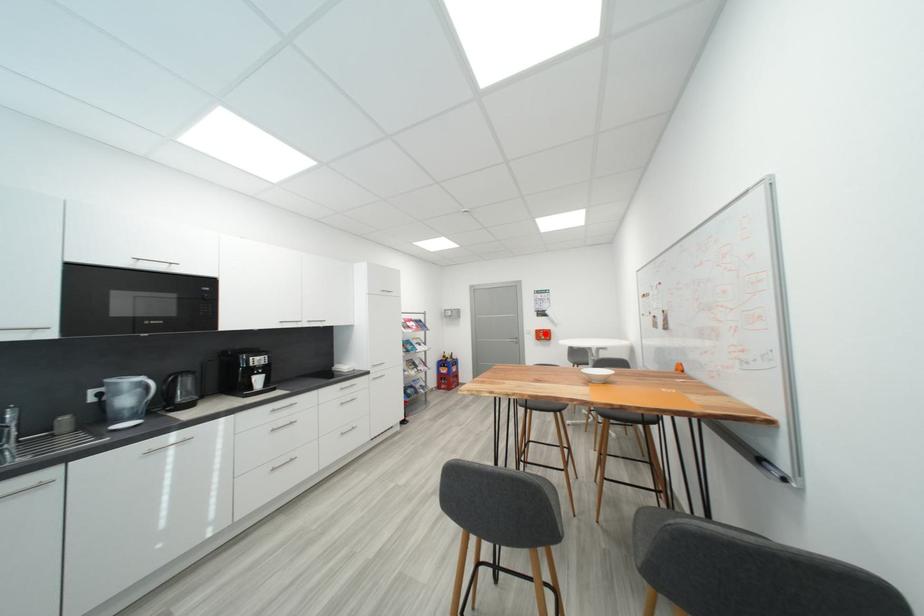
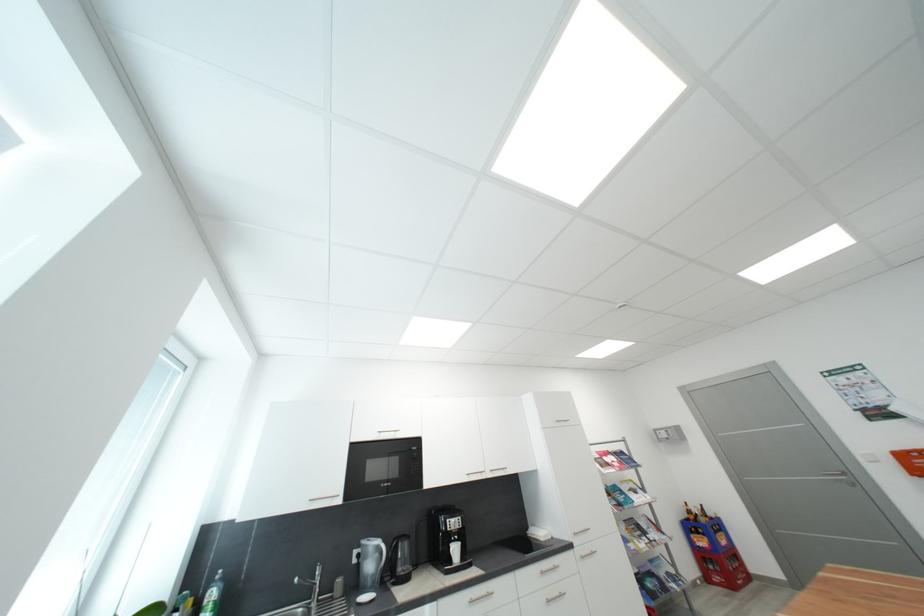
The point at the highlighted location is marked in the first image. Where is the corresponding point in the second image?

(910, 459)